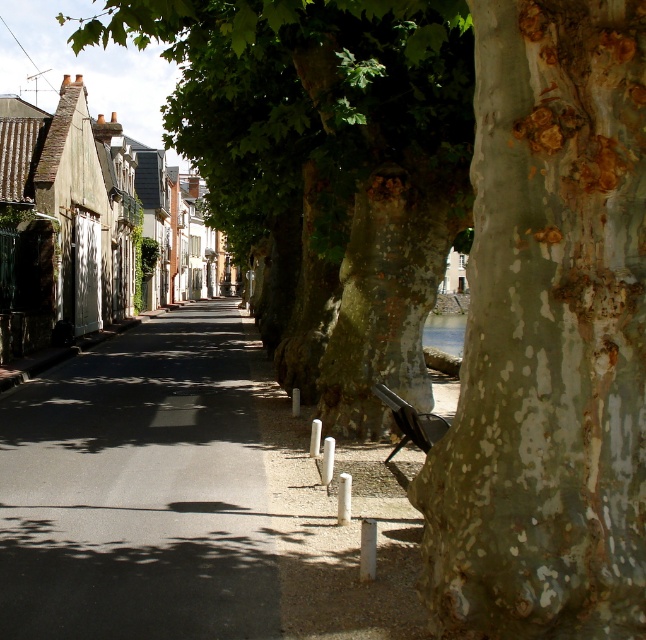
You are standing on the street depicted in the scene. There is a point marked at coordinates (547, 337). Which object in the scene does this point correspond to?

The point at (547, 337) corresponds to the speckled bark tree trunk at center.

You are a delivery person trying to navigate a narrow alleyway. You see a speckled bark tree trunk at center and an asphalt road at center. Which object is taller and could potentially block your delivery vehicle?

The speckled bark tree trunk at center is taller than the asphalt road at center, so it could potentially block the delivery vehicle.